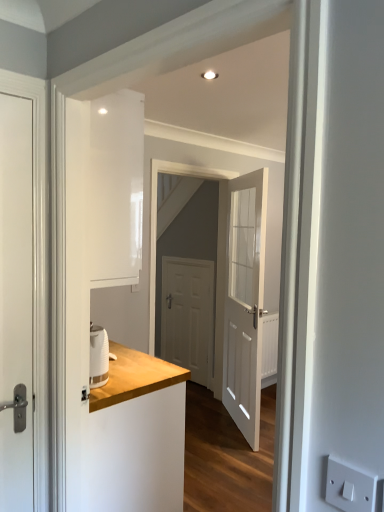
Question: From the image's perspective, does white matte door at center, positioned as the second door in right-to-left order, appear lower than white wooden door at center, which ranks as the 2th door in back-to-front order?

Choices:
 (A) no
 (B) yes

Answer: (B)

Question: From the image's perspective, is white matte door at center, positioned as the 3th door in front-to-back order, on white wooden door at center, which ranks as the 1th door in right-to-left order?

Choices:
 (A) yes
 (B) no

Answer: (B)

Question: Considering the relative sizes of white matte door at center, which is the second door in left-to-right order, and white wooden door at center, which ranks as the 2th door in back-to-front order, in the image provided, is white matte door at center, which is the second door in left-to-right order, taller than white wooden door at center, which ranks as the 2th door in back-to-front order,?

Choices:
 (A) yes
 (B) no

Answer: (B)

Question: Does white matte door at center, positioned as the 3th door in front-to-back order, appear on the right side of white wooden door at center, which is the 3th door in left-to-right order?

Choices:
 (A) yes
 (B) no

Answer: (B)

Question: Is white matte door at center, which is the second door in left-to-right order, facing towards white wooden door at center, which ranks as the 2th door in back-to-front order?

Choices:
 (A) no
 (B) yes

Answer: (A)

Question: Is white matte door at center, placed as the 1th door when sorted from back to front, positioned behind white wooden door at center, which ranks as the 1th door in right-to-left order?

Choices:
 (A) no
 (B) yes

Answer: (B)

Question: Is white matte door at left, which ranks as the 1th door in front-to-back order, far from wooden counter at left?

Choices:
 (A) no
 (B) yes

Answer: (A)

Question: Does white matte door at left, which is the first door from left to right, contain wooden counter at left?

Choices:
 (A) no
 (B) yes

Answer: (A)

Question: Is white matte door at left, which is the first door from left to right, shorter than wooden counter at left?

Choices:
 (A) no
 (B) yes

Answer: (A)

Question: Is white matte door at left, the 3th door from the right, outside of wooden counter at left?

Choices:
 (A) yes
 (B) no

Answer: (A)

Question: Is white matte door at left, which ranks as the 1th door in front-to-back order, thinner than wooden counter at left?

Choices:
 (A) no
 (B) yes

Answer: (B)

Question: Is white matte door at left, the 3th door from the right, wider than wooden counter at left?

Choices:
 (A) yes
 (B) no

Answer: (B)

Question: Does white matte door at left, which is the first door from left to right, have a greater height compared to white plastic electric outlet at lower right?

Choices:
 (A) no
 (B) yes

Answer: (B)